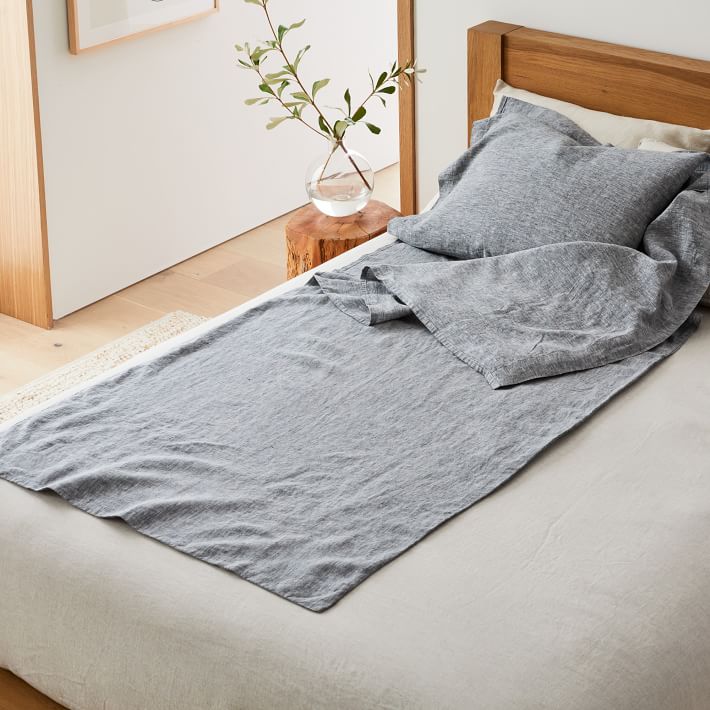
Identify the location of rug. (87, 366).